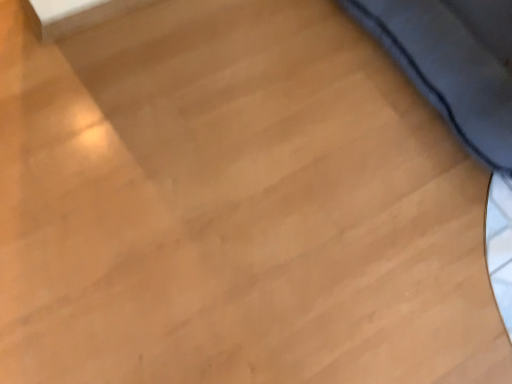
Question: Should I look upward or downward to see dark blue fabric sleeping bag at upper right?

Choices:
 (A) down
 (B) up

Answer: (B)